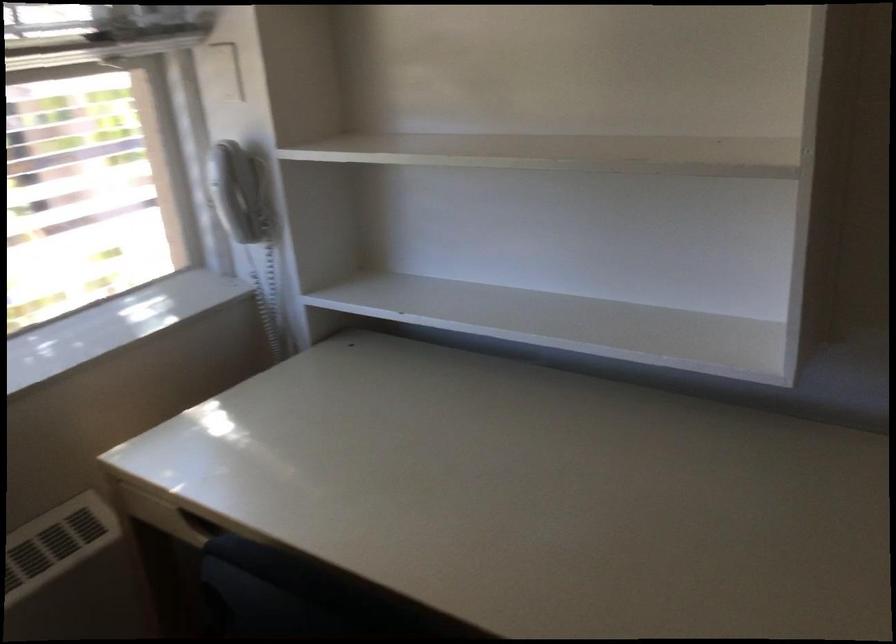
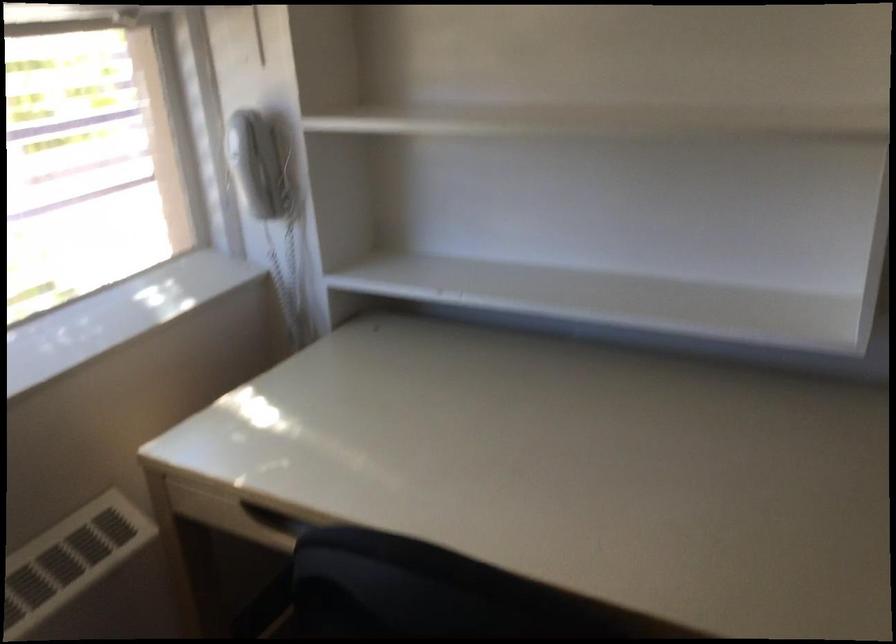
Where in the second image is the point corresponding to [184,523] from the first image?

(239, 516)